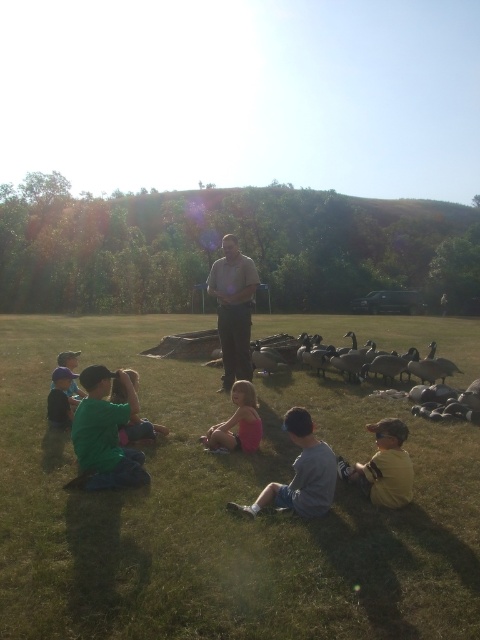
You are a photographer trying to capture the green matte shirt at lower left. What are the coordinates where you should focus your camera?

The coordinates to focus on are (105,433).

You are a photographer trying to capture a photo of the green grass at center and the yellow cotton shirt at lower right in the scene. Based on their positions, which object should appear higher in the photo?

The green grass at center should appear higher in the photo because it is located above the yellow cotton shirt at lower right.